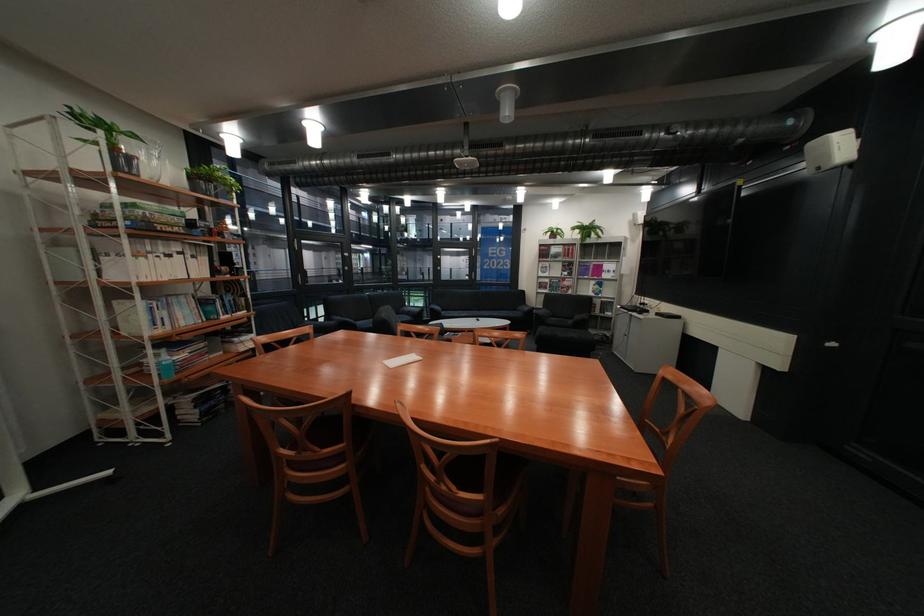
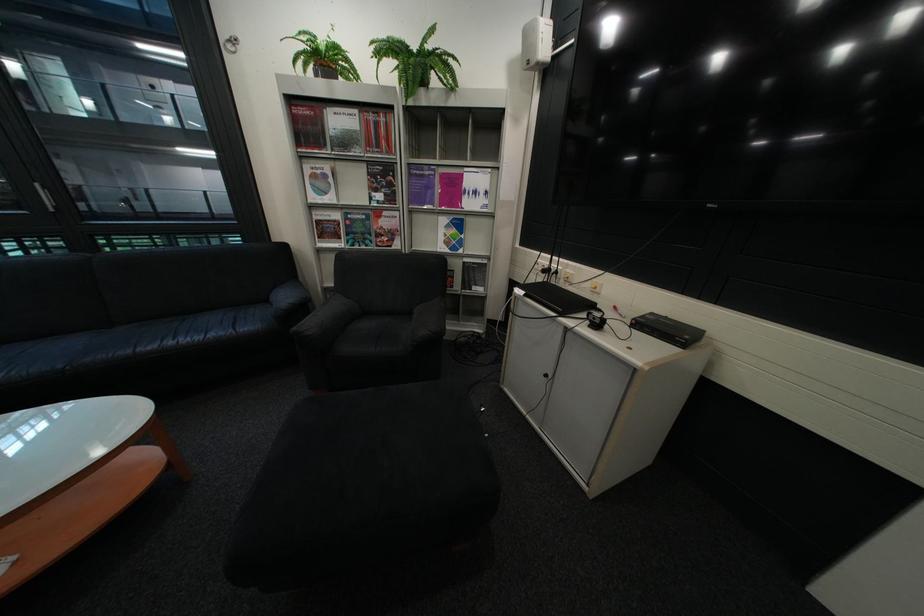
In the second image, find the point that corresponds to (x=588, y=272) in the first image.

(409, 192)